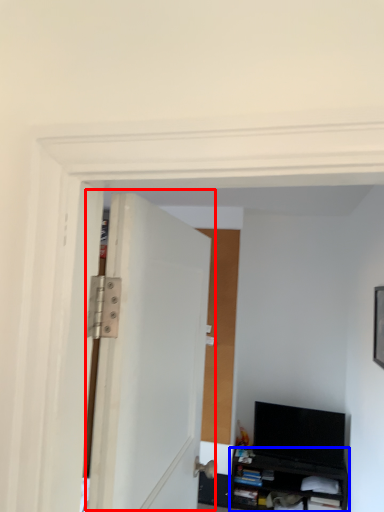
Question: Which of the following is the closest to the observer, door (highlighted by a red box) or cabinetry (highlighted by a blue box)?

Choices:
 (A) door
 (B) cabinetry

Answer: (A)